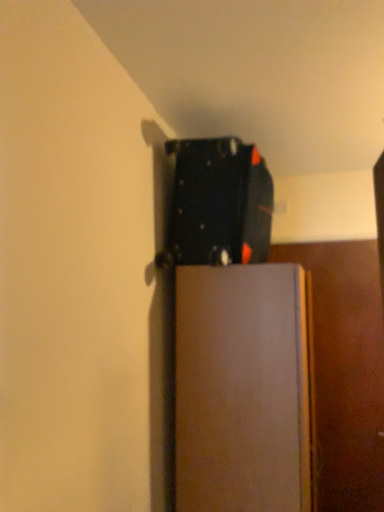
Describe the element at coordinates (218, 204) in the screenshot. The image size is (384, 512). I see `matte black suitcase at upper center` at that location.

The width and height of the screenshot is (384, 512). In order to click on matte black suitcase at upper center in this screenshot , I will do `click(218, 204)`.

What are the coordinates of `matte black suitcase at upper center` in the screenshot? It's located at (218, 204).